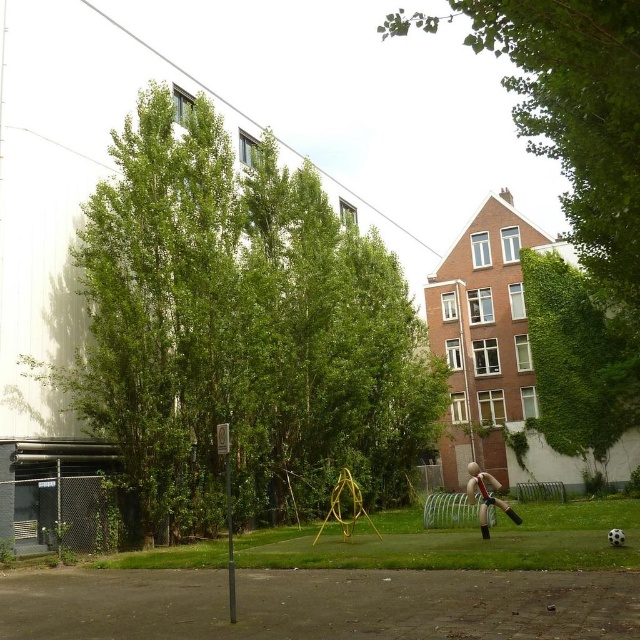
Question: Which of the following is the closest to the observer?

Choices:
 (A) green leafy tree at upper center
 (B) smooth beige mannequin at center
 (C) green leafy tree at center

Answer: (A)

Question: Which object is the farthest from the green leafy tree at center?

Choices:
 (A) green leafy tree at upper center
 (B) smooth beige mannequin at center

Answer: (A)

Question: Does green leafy tree at upper center lie behind smooth beige mannequin at center?

Choices:
 (A) no
 (B) yes

Answer: (A)

Question: Does green leafy tree at upper center appear under smooth beige mannequin at center?

Choices:
 (A) yes
 (B) no

Answer: (B)

Question: Estimate the real-world distances between objects in this image. Which object is farther from the smooth beige mannequin at center?

Choices:
 (A) green leafy tree at upper center
 (B) green leafy tree at center

Answer: (A)

Question: Is green leafy tree at center positioned before smooth beige mannequin at center?

Choices:
 (A) no
 (B) yes

Answer: (A)